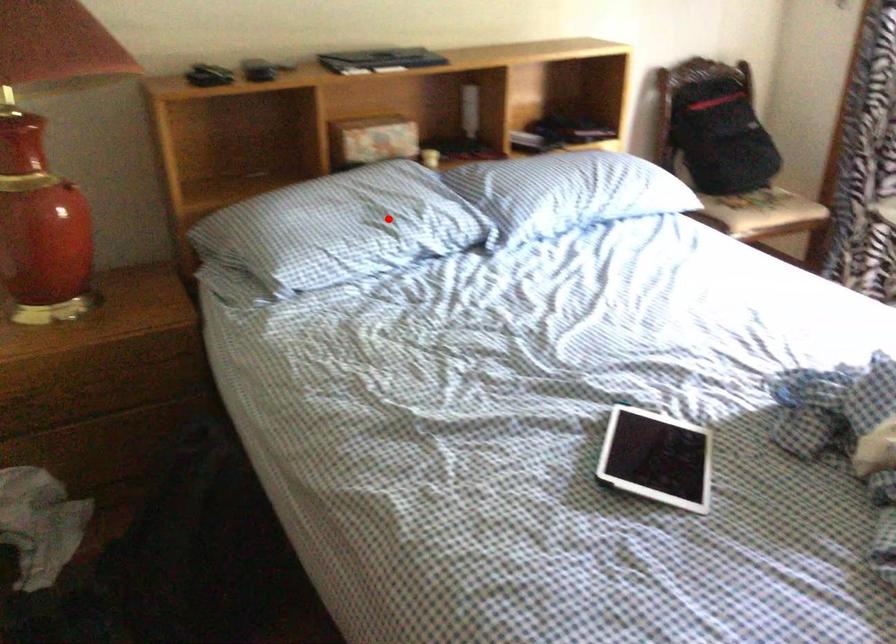
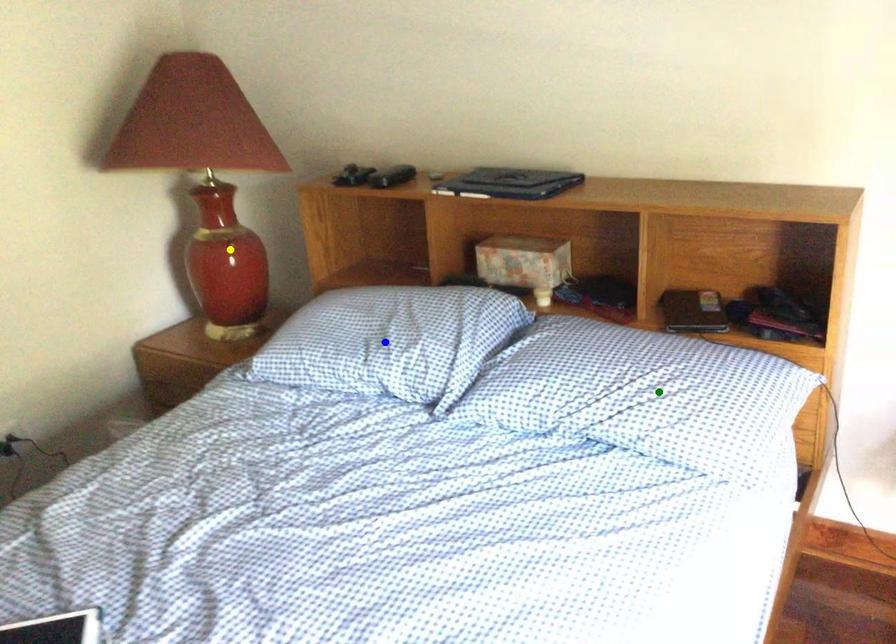
Question: I am providing you with two images of the same scene from different viewpoints. A red point is marked on the first image. You are given multiple points on the second image. Which spot in image 2 lines up with the point in image 1?

Choices:
 (A) blue point
 (B) yellow point
 (C) green point

Answer: (A)